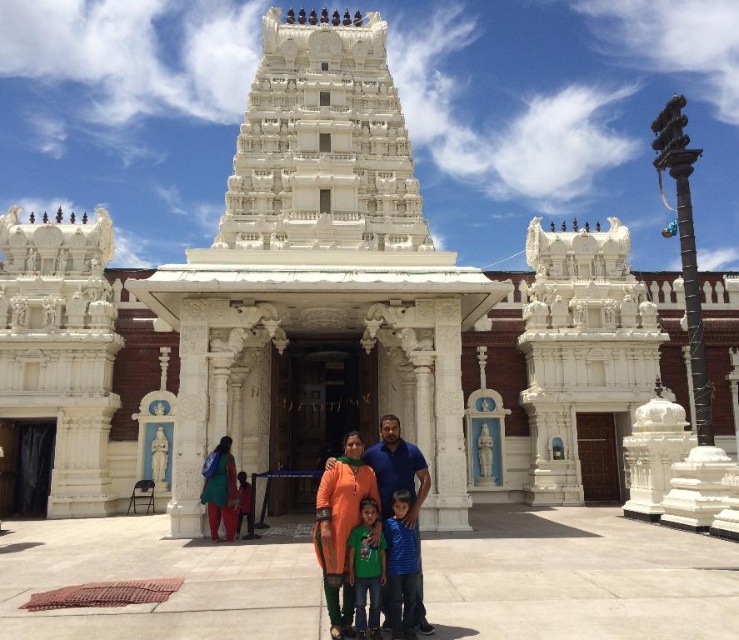
The image size is (739, 640). Describe the element at coordinates (401, 465) in the screenshot. I see `orange fabric family at center` at that location.

Who is higher up, orange fabric family at center or green fabric dress at lower left?

orange fabric family at center is above.

Between point (406, 449) and point (207, 481), which one is positioned in front?

Positioned in front is point (406, 449).

This screenshot has width=739, height=640. Find the location of `orange fabric family at center`. orange fabric family at center is located at coordinates (401, 465).

Does white marble hindu temple at center have a lesser height compared to blue striped shirt at center?

No, white marble hindu temple at center is not shorter than blue striped shirt at center.

Can you confirm if white marble hindu temple at center is thinner than blue striped shirt at center?

No.

Identify the location of white marble hindu temple at center. (319, 264).

Locate an element on the screen. white marble hindu temple at center is located at coordinates (319, 264).

Is white marble hindu temple at center below dark orange fabric at center?

Incorrect, white marble hindu temple at center is not positioned below dark orange fabric at center.

Who is more forward, (265, 408) or (241, 481)?

Positioned in front is point (241, 481).

This screenshot has width=739, height=640. I want to click on white marble hindu temple at center, so click(319, 264).

The height and width of the screenshot is (640, 739). I want to click on white marble hindu temple at center, so click(319, 264).